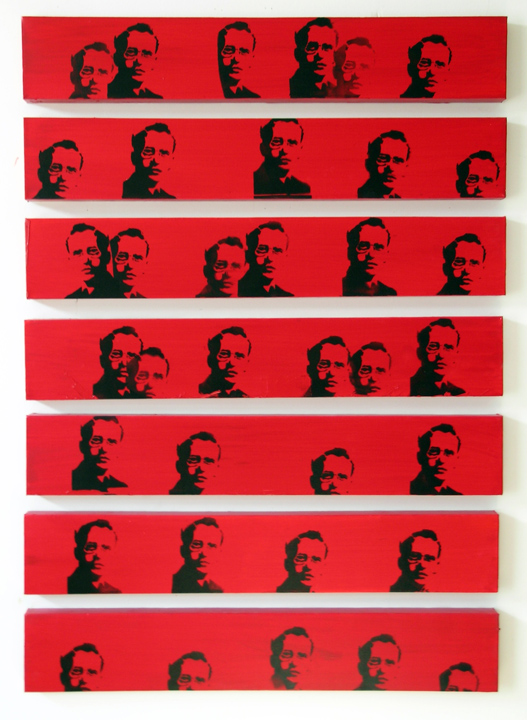
The image size is (527, 720). What are the coordinates of `red wooden slat` in the screenshot? It's located at (269, 55), (232, 156), (296, 261), (276, 366), (266, 459), (261, 558), (241, 647).